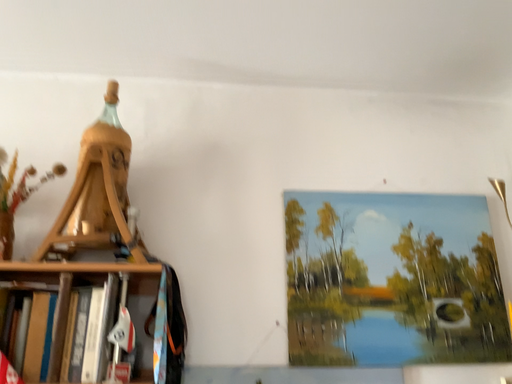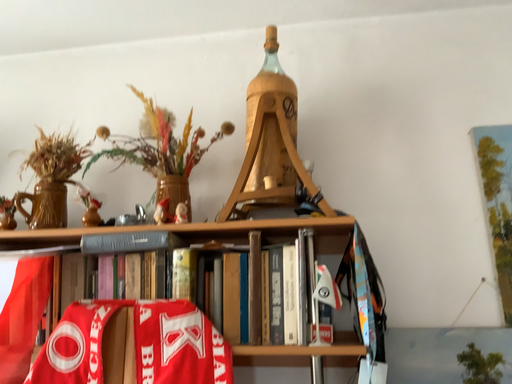
Question: Which way did the camera rotate in the video?

Choices:
 (A) rotated right
 (B) rotated left

Answer: (B)